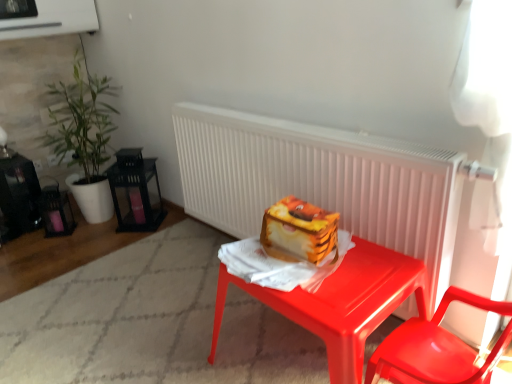
Question: Is glossy plastic desk at center behind white matte radiator at center?

Choices:
 (A) no
 (B) yes

Answer: (A)

Question: From the image's perspective, is glossy plastic desk at center above white matte radiator at center?

Choices:
 (A) yes
 (B) no

Answer: (B)

Question: Can you confirm if glossy plastic desk at center is thinner than white matte radiator at center?

Choices:
 (A) no
 (B) yes

Answer: (A)

Question: Is glossy plastic desk at center at the left side of white matte radiator at center?

Choices:
 (A) no
 (B) yes

Answer: (A)

Question: Is glossy plastic desk at center at the right side of white matte radiator at center?

Choices:
 (A) yes
 (B) no

Answer: (A)

Question: Is the depth of glossy plastic desk at center less than that of white matte radiator at center?

Choices:
 (A) yes
 (B) no

Answer: (A)

Question: Is glossy plastic chair at lower right completely or partially outside of glossy plastic desk at center?

Choices:
 (A) yes
 (B) no

Answer: (A)

Question: Is glossy plastic chair at lower right with glossy plastic desk at center?

Choices:
 (A) no
 (B) yes

Answer: (A)

Question: Is glossy plastic chair at lower right in front of glossy plastic desk at center?

Choices:
 (A) yes
 (B) no

Answer: (A)

Question: Does glossy plastic chair at lower right have a lesser height compared to glossy plastic desk at center?

Choices:
 (A) no
 (B) yes

Answer: (A)

Question: Could glossy plastic desk at center be considered to be inside glossy plastic chair at lower right?

Choices:
 (A) yes
 (B) no

Answer: (B)

Question: Considering the relative sizes of glossy plastic chair at lower right and glossy plastic desk at center in the image provided, is glossy plastic chair at lower right smaller than glossy plastic desk at center?

Choices:
 (A) yes
 (B) no

Answer: (A)

Question: Is white matte radiator at center further to the viewer compared to green leafy plant at left?

Choices:
 (A) no
 (B) yes

Answer: (A)